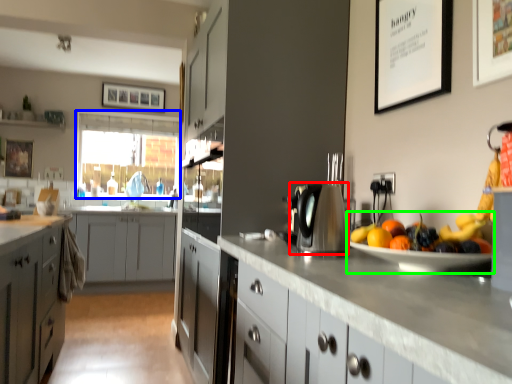
Question: Estimate the real-world distances between objects in this image. Which object is farther from kitchen appliance (highlighted by a red box), window screen (highlighted by a blue box) or fruit dish (highlighted by a green box)?

Choices:
 (A) window screen
 (B) fruit dish

Answer: (A)